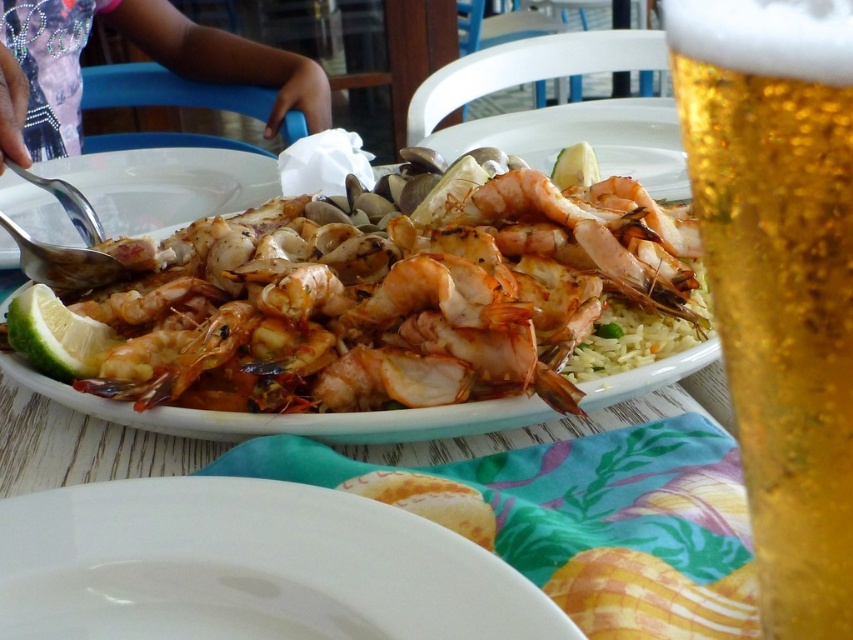
You are a bartender preparing a drink order. You have a golden liquid beer at right and a green matte lemon at lower left on the table. Which object takes up more space on the table?

The golden liquid beer at right is larger in size than the green matte lemon at lower left, so it takes up more space on the table.

You are a food photographer setting up a shot of the seafood paella. You need to position the golden liquid beer at right so that it is exactly 4 inches away from the camera. Currently, it is 3.53 inches away. Should you move the beer closer or farther away?

The golden liquid beer at right is currently 3.53 inches away from the camera. To reach the desired 4 inches, you should move it farther away by approximately 0.47 inches.

From the picture: You are a server who needs to place a 12 inch wide tray between the golden liquid beer at right and the matte white plate at upper left. Is there enough space to fit the tray without it touching either object?

The distance between the golden liquid beer at right and the matte white plate at upper left is 23.74 inches. Since the tray is 12 inches wide, there is enough space to place it between them without touching either object.